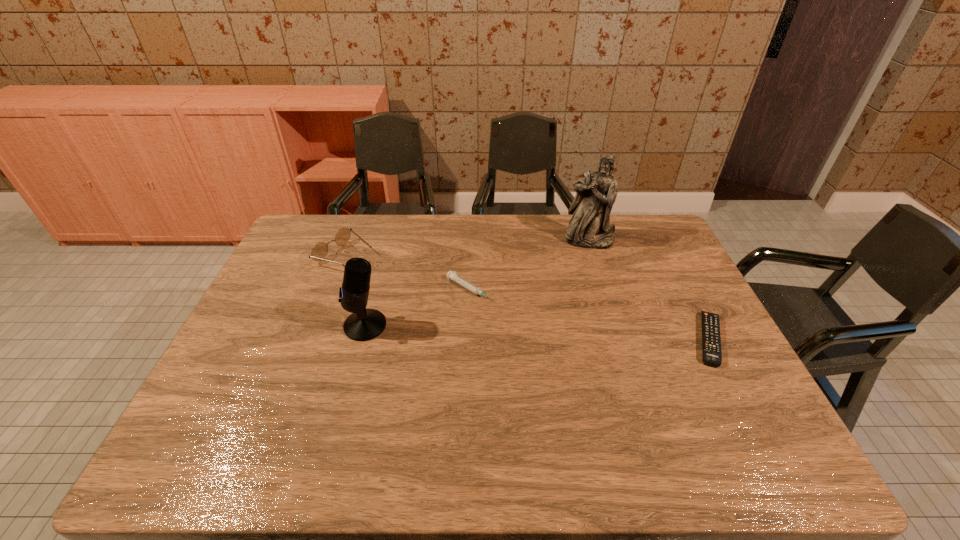
This screenshot has height=540, width=960. In the image, there is a desktop. Find the location of `vacant space at the far right corner`. vacant space at the far right corner is located at coordinates (658, 221).

You are a GUI agent. You are given a task and a screenshot of the screen. Output one action in this format:
    pyautogui.click(x=<x>, y=<y>)
    Task: Click on the free area in between the third nearest object and the fourth shortest object
    This screenshot has width=960, height=540.
    Given the screenshot: What is the action you would take?
    pyautogui.click(x=418, y=308)

What are the coordinates of `free spot between the third nearest object and the microphone` in the screenshot? It's located at (418, 308).

Locate an element on the screen. vacant area that lies between the microphone and the second object from right to left is located at coordinates (477, 282).

Image resolution: width=960 pixels, height=540 pixels. In order to click on unoccupied position between the fourth object from left to right and the third tallest object in this screenshot , I will do coord(468,248).

Where is `free space between the fourth shortest object and the figurine`? free space between the fourth shortest object and the figurine is located at coordinates (477, 282).

You are a GUI agent. You are given a task and a screenshot of the screen. Output one action in this format:
    pyautogui.click(x=<x>, y=<y>)
    Task: Click on the vacant space in between the syringe and the spectacles
    The image size is (960, 540).
    Given the screenshot: What is the action you would take?
    pyautogui.click(x=407, y=273)

I want to click on vacant point located between the third object from left to right and the third tallest object, so click(x=407, y=273).

Image resolution: width=960 pixels, height=540 pixels. I want to click on free space that is in between the third farthest object and the spectacles, so click(407, 273).

At what (x,y) coordinates should I click in order to perform the action: click on free point between the second shortest object and the remote control. Please return your answer as a coordinate pair (x, y). The width and height of the screenshot is (960, 540). Looking at the image, I should click on click(589, 314).